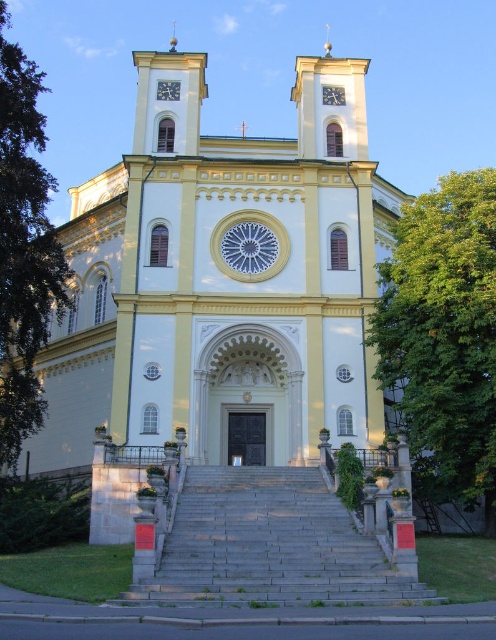
Between point (146, 161) and point (165, 93), which one is positioned in front?

Point (146, 161)

Does yellow stone church at center appear under metallic clock at upper center?

Incorrect, yellow stone church at center is not positioned below metallic clock at upper center.

Which is behind, point (196, 76) or point (172, 99)?

The point (196, 76) is more distant.

This screenshot has width=496, height=640. I want to click on yellow stone church at center, so click(222, 282).

Can you confirm if yellow stone church at center is smaller than metallic clock face at center?

No.

Is point (319, 340) more distant than point (338, 92)?

No, it is in front of (338, 92).

This screenshot has width=496, height=640. What are the coordinates of `yellow stone church at center` in the screenshot? It's located at (222, 282).

Does green leafy tree at right have a lesser height compared to metallic clock at upper center?

No, green leafy tree at right is not shorter than metallic clock at upper center.

Can you confirm if green leafy tree at right is positioned below metallic clock at upper center?

Yes.

Find the location of a particular element. Image resolution: width=496 pixels, height=640 pixels. green leafy tree at right is located at coordinates (443, 337).

I want to click on green leafy tree at right, so click(443, 337).